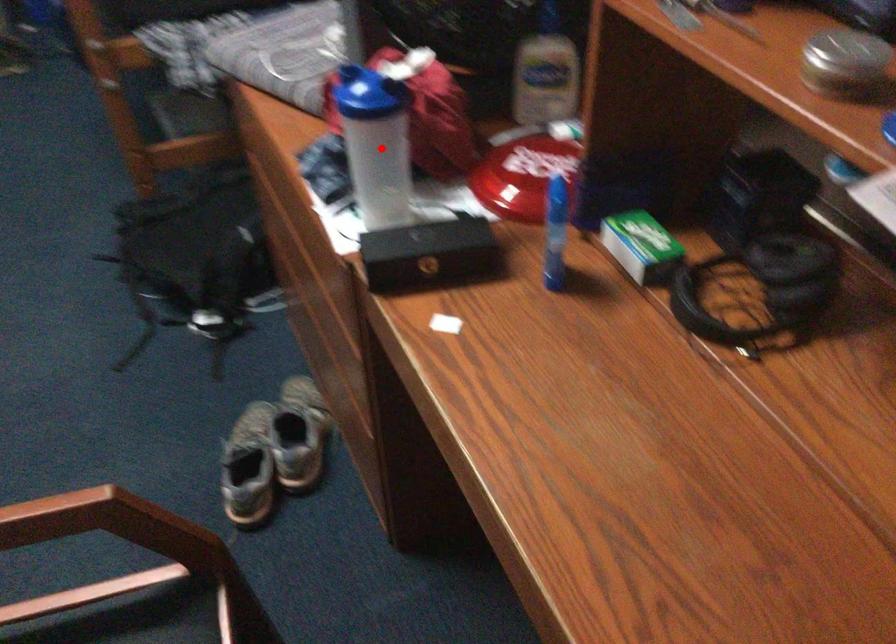
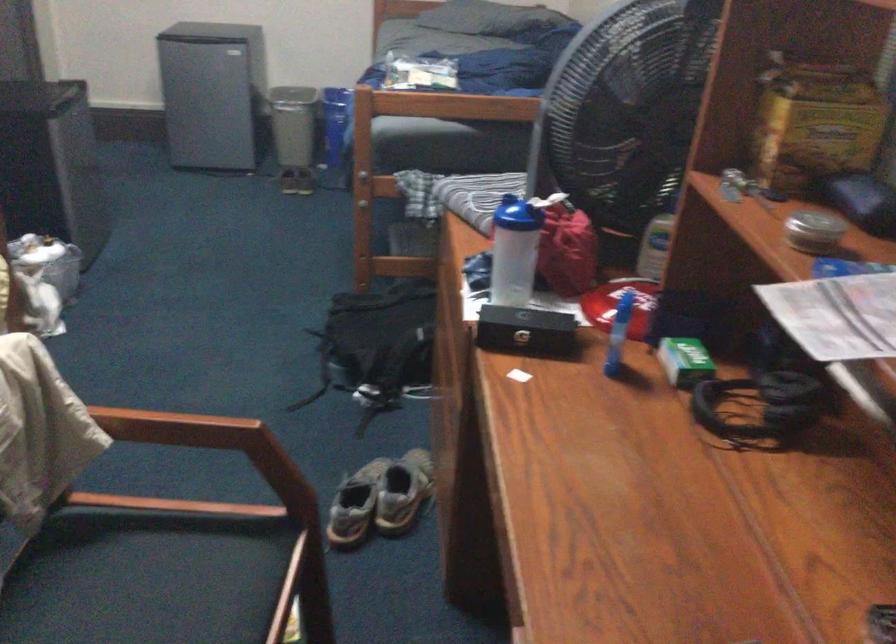
Where in the second image is the point corresponding to the highlighted location from the first image?

(513, 251)